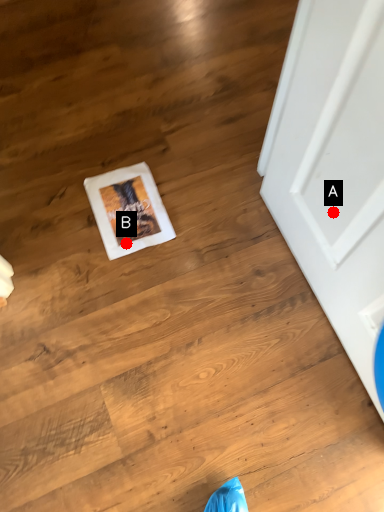
Question: Two points are circled on the image, labeled by A and B beside each circle. Which point is closer to the camera taking this photo?

Choices:
 (A) A is closer
 (B) B is closer

Answer: (A)